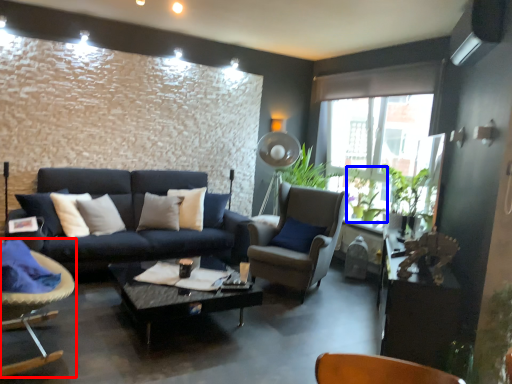
Question: Which object is closer to the camera taking this photo, chair (highlighted by a red box) or plant (highlighted by a blue box)?

Choices:
 (A) chair
 (B) plant

Answer: (A)